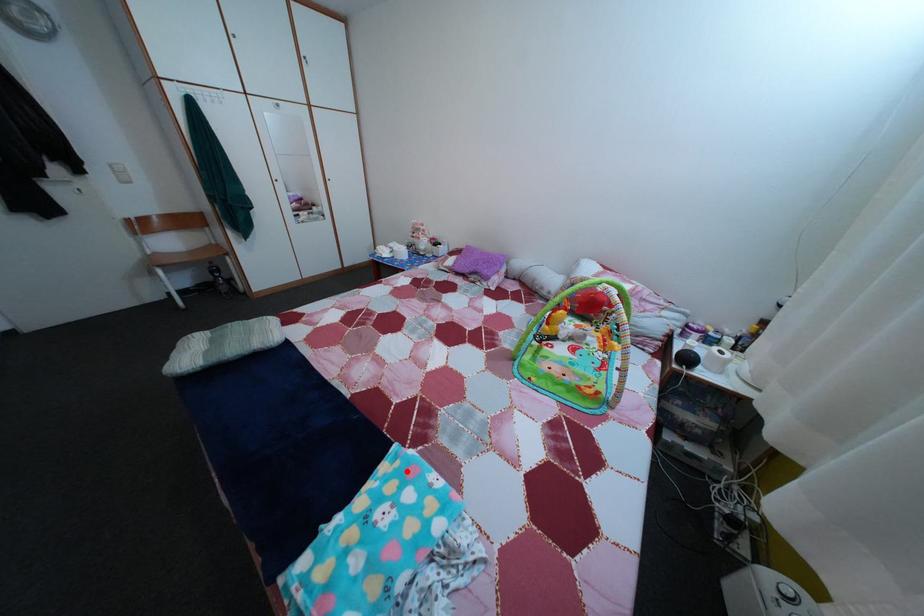
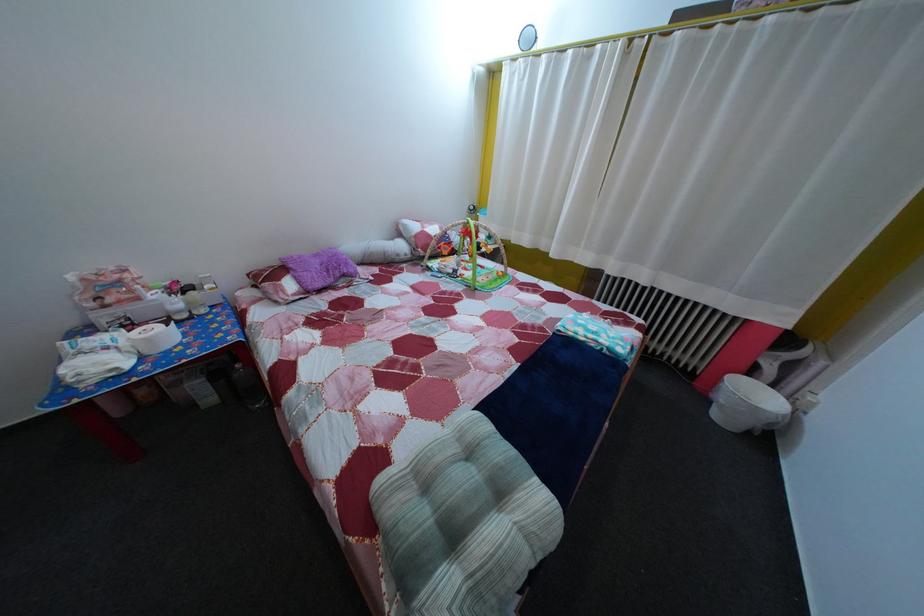
The point at the highlighted location is marked in the first image. Where is the corresponding point in the second image?

(578, 334)